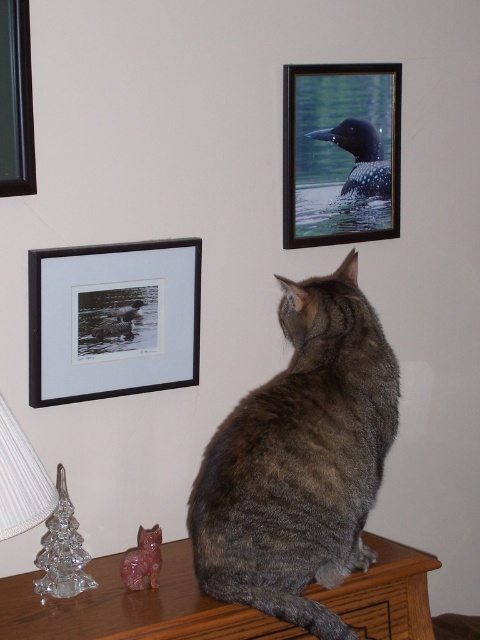
Who is positioned more to the left, black matte frame at upper left or wooden table at lower center?

Positioned to the left is black matte frame at upper left.

Who is higher up, black matte frame at upper left or wooden table at lower center?

black matte frame at upper left is above.

Where is `black matte frame at upper left`? black matte frame at upper left is located at coordinates (112, 320).

This screenshot has height=640, width=480. I want to click on black matte frame at upper left, so click(112, 320).

Is wooden table at lower center behind wooden frame at upper right?

No, wooden table at lower center is in front of wooden frame at upper right.

Is wooden table at lower center below wooden frame at upper right?

Yes.

Is point (181, 625) in front of point (388, 83)?

That is True.

Find the location of `wooden table at lower center`. wooden table at lower center is located at coordinates [132, 608].

Does gray fur cat at center appear on the left side of black glass picture frame at upper left?

In fact, gray fur cat at center is to the right of black glass picture frame at upper left.

Does gray fur cat at center have a smaller size compared to black glass picture frame at upper left?

Actually, gray fur cat at center might be larger than black glass picture frame at upper left.

What do you see at coordinates (300, 460) in the screenshot? I see `gray fur cat at center` at bounding box center [300, 460].

Image resolution: width=480 pixels, height=640 pixels. What are the coordinates of `gray fur cat at center` in the screenshot? It's located at (300, 460).